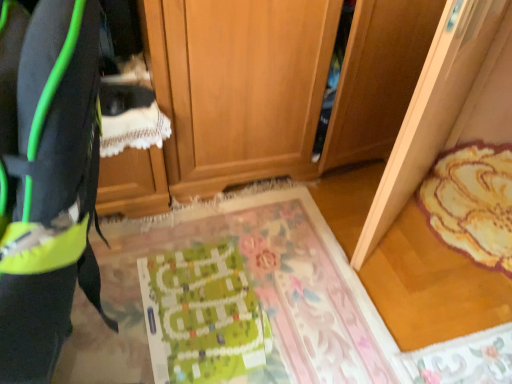
Where is `vacant space underneath green fabric mat at center, which is the second mat in right-to-left order (from a real-world perspective)`? vacant space underneath green fabric mat at center, which is the second mat in right-to-left order (from a real-world perspective) is located at coordinates (234, 289).